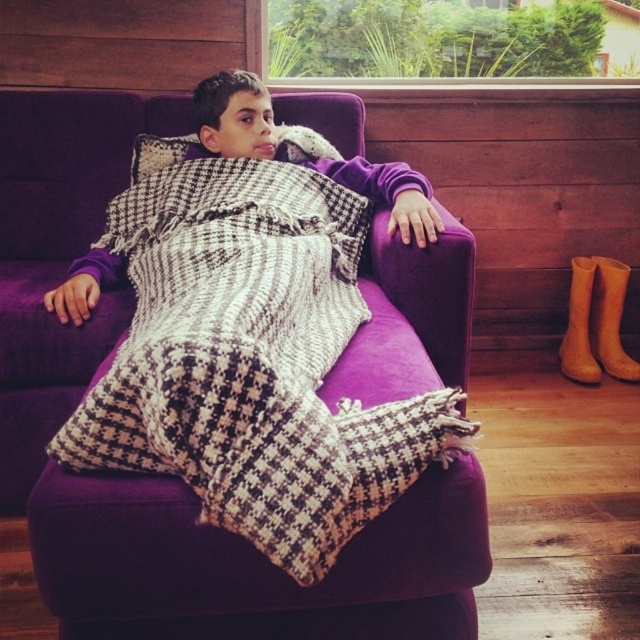
Can you confirm if brown suede boot at lower right is positioned above houndstooth fabric pillow at upper center?

No.

Measure the distance between brown suede boot at lower right and camera.

brown suede boot at lower right and camera are 7.19 feet apart.

This screenshot has height=640, width=640. What are the coordinates of `brown suede boot at lower right` in the screenshot? It's located at (609, 317).

Is point (317, 140) positioned in front of point (584, 348)?

Yes, it is in front of point (584, 348).

Measure the distance between houndstooth fabric pillow at upper center and camera.

They are 1.79 meters apart.

You are a GUI agent. You are given a task and a screenshot of the screen. Output one action in this format:
    pyautogui.click(x=<x>, y=<y>)
    Task: Click on the houndstooth fabric pillow at upper center
    The height and width of the screenshot is (640, 640).
    Given the screenshot: What is the action you would take?
    pyautogui.click(x=161, y=154)

Find the location of a particular element. The image size is (640, 640). houndstooth fabric pillow at upper center is located at coordinates (161, 154).

Who is positioned more to the left, purple fabric armchair at center or brown leather boot at right?

From the viewer's perspective, purple fabric armchair at center appears more on the left side.

Locate an element on the screen. purple fabric armchair at center is located at coordinates (253, 564).